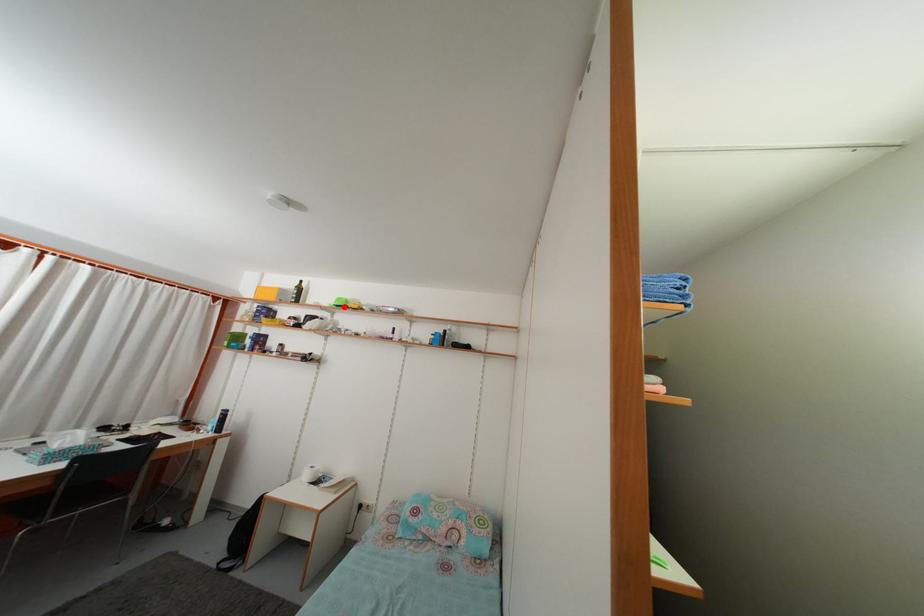
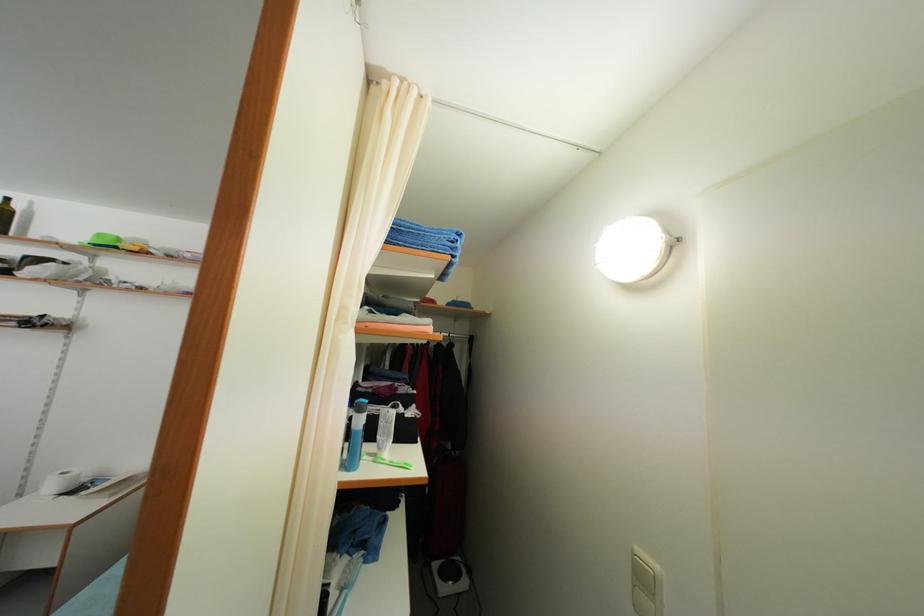
Find the pixel in the second image that matches the highlighted location in the first image.

(104, 243)